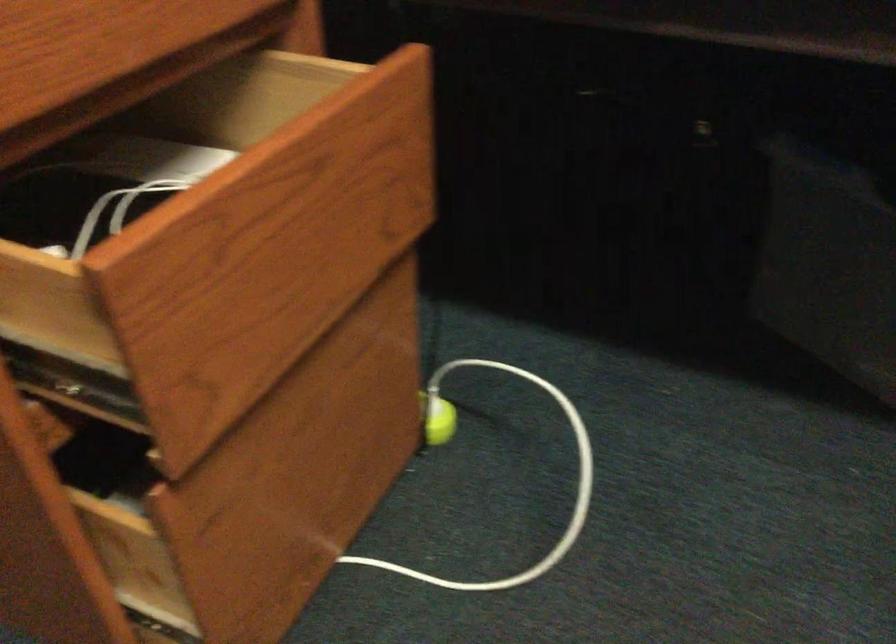
Locate an element on the screen. closed drawer edge is located at coordinates (323, 62).